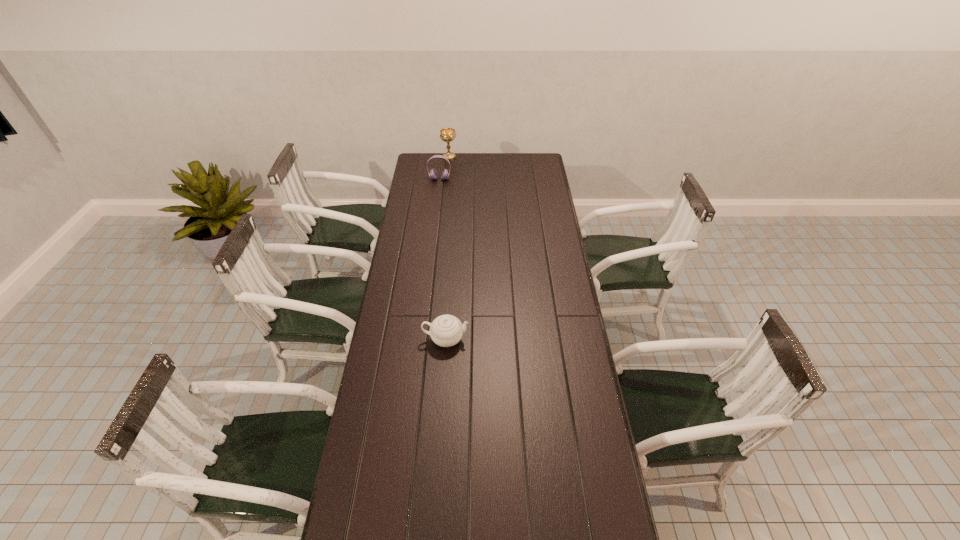
Where is `object at the far left corner`? The image size is (960, 540). object at the far left corner is located at coordinates (447, 135).

This screenshot has height=540, width=960. In order to click on free location at the far edge in this screenshot , I will do `click(508, 158)`.

Find the location of a particular element. The image size is (960, 540). free space at the left edge of the desktop is located at coordinates (404, 211).

Image resolution: width=960 pixels, height=540 pixels. In the image, there is a desktop. What are the coordinates of `blank space at the right edge` in the screenshot? It's located at (530, 213).

Where is `vacant space at the far right corner of the desktop`? This screenshot has width=960, height=540. vacant space at the far right corner of the desktop is located at coordinates (537, 168).

Identify the location of free spot between the nearest object and the headset. This screenshot has width=960, height=540. (443, 259).

At what (x,y) coordinates should I click in order to perform the action: click on free space between the chalice and the second nearest object. Please return your answer as a coordinate pair (x, y). The image size is (960, 540). Looking at the image, I should click on (444, 168).

I want to click on vacant area between the second nearest object and the shortest object, so click(x=443, y=259).

The image size is (960, 540). Identify the location of empty space between the chinaware and the farthest object. (447, 248).

Identify the location of empty space between the chinaware and the chalice. (447, 248).